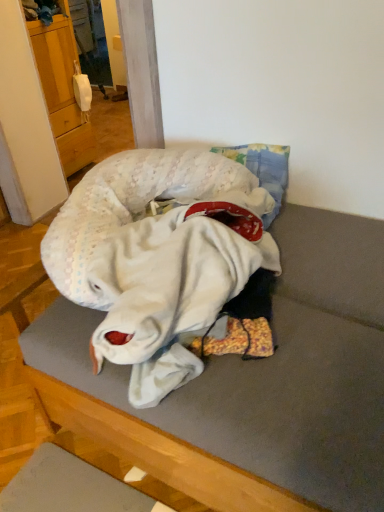
Where is `white fabric pillow at center`? white fabric pillow at center is located at coordinates (263, 376).

Where is `wooden cabinet at left`? This screenshot has height=512, width=384. wooden cabinet at left is located at coordinates (62, 89).

At what (x,y) coordinates should I click in order to perform the action: click on white fabric pillow at center. Please return your answer as a coordinate pair (x, y). This screenshot has width=384, height=512. Looking at the image, I should click on (263, 376).

Is wooden cabinet at left shorter than white fabric pillow at center?

In fact, wooden cabinet at left may be taller than white fabric pillow at center.

From a real-world perspective, who is located higher, wooden cabinet at left or white fabric pillow at center?

In real-world perspective, wooden cabinet at left is above.

How distant is wooden cabinet at left from white fabric pillow at center?

1.79 meters.

Does wooden cabinet at left turn towards white fabric pillow at center?

No, wooden cabinet at left is not aimed at white fabric pillow at center.

From the image's perspective, is white knitted baby at center above or below white fabric pillow at center?

Clearly, from the image's perspective, white knitted baby at center is above white fabric pillow at center.

Which object is positioned more to the left, white knitted baby at center or white fabric pillow at center?

From the viewer's perspective, white knitted baby at center appears more on the left side.

In the scene shown: Is white knitted baby at center not close to white fabric pillow at center?

No.

Which is closer to the camera, (226, 163) or (345, 321)?

Point (345, 321)

Considering the sizes of wooden cabinet at left and white knitted baby at center in the image, is wooden cabinet at left bigger or smaller than white knitted baby at center?

wooden cabinet at left is smaller than white knitted baby at center.

Considering the positions of objects wooden cabinet at left and white knitted baby at center in the image provided, who is more to the left, wooden cabinet at left or white knitted baby at center?

Positioned to the left is wooden cabinet at left.

Considering the sizes of wooden cabinet at left and white knitted baby at center in the image, is wooden cabinet at left taller or shorter than white knitted baby at center?

In the image, wooden cabinet at left appears to be taller than white knitted baby at center.

Between wooden cabinet at left and white knitted baby at center, which one has smaller width?

With smaller width is wooden cabinet at left.

Which object is wider, white fabric pillow at center or white knitted baby at center?

white fabric pillow at center is wider.

Can you confirm if white fabric pillow at center is smaller than white knitted baby at center?

Incorrect, white fabric pillow at center is not smaller in size than white knitted baby at center.

From the image's perspective, does white fabric pillow at center appear higher than white knitted baby at center?

No, from the image's perspective, white fabric pillow at center is not over white knitted baby at center.

Is there a large distance between white knitted baby at center and wooden cabinet at left?

white knitted baby at center is positioned a significant distance from wooden cabinet at left.

Which is more to the right, white knitted baby at center or wooden cabinet at left?

From the viewer's perspective, white knitted baby at center appears more on the right side.

Considering the sizes of objects white knitted baby at center and wooden cabinet at left in the image provided, who is taller, white knitted baby at center or wooden cabinet at left?

With more height is wooden cabinet at left.

Considering the relative sizes of white knitted baby at center and wooden cabinet at left in the image provided, is white knitted baby at center bigger than wooden cabinet at left?

Yes.

Can you tell me how much white fabric pillow at center and wooden cabinet at left differ in facing direction?

white fabric pillow at center and wooden cabinet at left are facing 178 degrees away from each other.

Does white fabric pillow at center turn towards wooden cabinet at left?

No, white fabric pillow at center is not facing towards wooden cabinet at left.

From the picture: From the image's perspective, is white fabric pillow at center above or below wooden cabinet at left?

From the image's perspective, white fabric pillow at center appears below wooden cabinet at left.

Locate an element on the screen. The image size is (384, 512). cabinetry behind the white fabric pillow at center is located at coordinates (62, 89).

Identify the location of furniture below the white knitted baby at center (from the image's perspective). (263, 376).

Which object lies nearer to the anchor point wooden cabinet at left, white knitted baby at center or white fabric pillow at center?

Based on the image, white knitted baby at center appears to be nearer to wooden cabinet at left.

When comparing their distances from wooden cabinet at left, does white fabric pillow at center or white knitted baby at center seem closer?

white knitted baby at center lies closer to wooden cabinet at left than the other object.

Looking at the image, which one is located further to white knitted baby at center, wooden cabinet at left or white fabric pillow at center?

wooden cabinet at left is further to white knitted baby at center.

Based on their spatial positions, is wooden cabinet at left or white knitted baby at center further from white fabric pillow at center?

Among the two, wooden cabinet at left is located further to white fabric pillow at center.

When comparing their distances from white knitted baby at center, does white fabric pillow at center or wooden cabinet at left seem closer?

The object closer to white knitted baby at center is white fabric pillow at center.

Looking at the image, which one is located further to white fabric pillow at center, white knitted baby at center or wooden cabinet at left?

wooden cabinet at left.

In order to click on baby between white fabric pillow at center and wooden cabinet at left from front to back in this screenshot , I will do `click(154, 247)`.